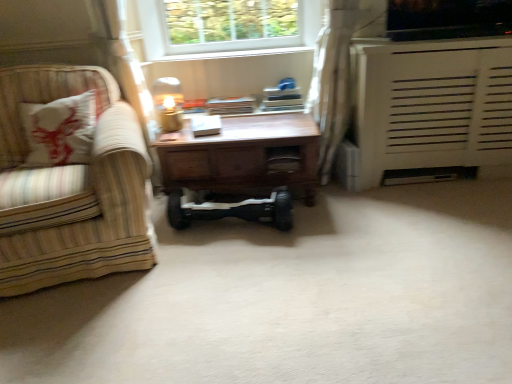
At what (x,y) coordinates should I click in order to perform the action: click on wooden desk at center. Please return your answer as a coordinate pair (x, y). This screenshot has width=512, height=384. Looking at the image, I should click on (239, 170).

Identify the location of white sheer curtain at upper right. The width and height of the screenshot is (512, 384). (332, 81).

Describe the element at coordinates (230, 208) in the screenshot. I see `black rubber hoverboard at center` at that location.

Describe the element at coordinates (168, 103) in the screenshot. I see `matte gold table lamp at center` at that location.

Image resolution: width=512 pixels, height=384 pixels. What do you see at coordinates (432, 105) in the screenshot? I see `white matte radiator at right` at bounding box center [432, 105].

The height and width of the screenshot is (384, 512). What are the coordinates of `striped fabric armchair at left` in the screenshot? It's located at (72, 188).

Locate an element on the screen. Image resolution: width=512 pixels, height=384 pixels. wooden desk at center is located at coordinates (239, 170).

Based on the photo, is wooden drawer at center bigger than matte gold table lamp at center?

No.

Between point (291, 159) and point (164, 86), which one is positioned behind?

The point (164, 86) is more distant.

Is the depth of wooden drawer at center greater than that of matte gold table lamp at center?

Yes.

Is wooden drawer at center directly adjacent to matte gold table lamp at center?

wooden drawer at center is not next to matte gold table lamp at center, and they're not touching.

Which of these two, wooden drawer at center or black rubber hoverboard at center, is smaller?

wooden drawer at center is smaller.

Could you tell me if wooden drawer at center is turned towards black rubber hoverboard at center?

No, wooden drawer at center is not oriented towards black rubber hoverboard at center.

From the image's perspective, between wooden drawer at center and black rubber hoverboard at center, who is located below?

From the image's view, black rubber hoverboard at center is below.

Would you say wooden drawer at center is a long distance from black rubber hoverboard at center?

That's not correct — wooden drawer at center is a little close to black rubber hoverboard at center.

Locate an element on the screen. curtain on the right of striped fabric armchair at left is located at coordinates (332, 81).

In the image, is striped fabric armchair at left positioned in front of or behind white sheer curtain at upper right?

Visually, striped fabric armchair at left is located in front of white sheer curtain at upper right.

Can you confirm if striped fabric armchair at left is positioned to the right of white sheer curtain at upper right?

No, striped fabric armchair at left is not to the right of white sheer curtain at upper right.

From the image's perspective, is striped fabric armchair at left below white sheer curtain at upper right?

Yes.

From the image's perspective, would you say matte gold table lamp at center is positioned over wooden desk at center?

Indeed, from the image's perspective, matte gold table lamp at center is shown above wooden desk at center.

Is the depth of matte gold table lamp at center greater than that of wooden desk at center?

Yes, it is behind wooden desk at center.

Are matte gold table lamp at center and wooden desk at center located far from each other?

Actually, matte gold table lamp at center and wooden desk at center are a little close together.

Does matte gold table lamp at center have a lesser width compared to wooden desk at center?

Yes, matte gold table lamp at center is thinner than wooden desk at center.

Does black rubber hoverboard at center have a larger size compared to striped fabric armchair at left?

No.

How different are the orientations of black rubber hoverboard at center and striped fabric armchair at left in degrees?

23.6 degrees.

Considering the relative sizes of black rubber hoverboard at center and striped fabric armchair at left in the image provided, is black rubber hoverboard at center taller than striped fabric armchair at left?

No.

You are a GUI agent. You are given a task and a screenshot of the screen. Output one action in this format:
    pyautogui.click(x=<x>, y=<y>)
    Task: Click on the chair that appears in front of the black rubber hoverboard at center
    The height and width of the screenshot is (384, 512).
    Given the screenshot: What is the action you would take?
    (72, 188)

In the image, is striped fabric armchair at left positioned in front of or behind black rubber hoverboard at center?

In the image, striped fabric armchair at left appears in front of black rubber hoverboard at center.

Who is bigger, striped fabric armchair at left or black rubber hoverboard at center?

striped fabric armchair at left.

Choose the correct answer: Is striped fabric armchair at left inside black rubber hoverboard at center or outside it?

striped fabric armchair at left is located beyond the bounds of black rubber hoverboard at center.

Is striped fabric armchair at left placed right next to black rubber hoverboard at center?

No, striped fabric armchair at left is not making contact with black rubber hoverboard at center.

From a real-world perspective, is black rubber hoverboard at center on wooden drawer at center?

Actually, black rubber hoverboard at center is physically below wooden drawer at center in the real world.

Is black rubber hoverboard at center not near wooden drawer at center?

No, there isn't a large distance between black rubber hoverboard at center and wooden drawer at center.

Who is taller, black rubber hoverboard at center or wooden drawer at center?

black rubber hoverboard at center.

Does black rubber hoverboard at center turn towards wooden drawer at center?

No, black rubber hoverboard at center is not aimed at wooden drawer at center.

Where is `table lamp above the wooden drawer at center (from a real-world perspective)`? The height and width of the screenshot is (384, 512). table lamp above the wooden drawer at center (from a real-world perspective) is located at coordinates (168, 103).

Image resolution: width=512 pixels, height=384 pixels. I want to click on baby carriage lying below the wooden drawer at center (from the image's perspective), so click(230, 208).

Based on their spatial positions, is white matte radiator at right or wooden drawer at center further from white sheer curtain at upper right?

The object further to white sheer curtain at upper right is wooden drawer at center.

Which object lies nearer to the anchor point wooden drawer at center, matte gold table lamp at center or black rubber hoverboard at center?

Based on the image, black rubber hoverboard at center appears to be nearer to wooden drawer at center.

Which object lies further to the anchor point matte gold table lamp at center, wooden drawer at center or striped fabric armchair at left?

wooden drawer at center is positioned further to the anchor matte gold table lamp at center.

Which object lies nearer to the anchor point black rubber hoverboard at center, wooden desk at center or matte gold table lamp at center?

wooden desk at center.

Consider the image. Considering their positions, is matte gold table lamp at center positioned closer to black rubber hoverboard at center than white matte radiator at right?

Among the two, matte gold table lamp at center is located nearer to black rubber hoverboard at center.

From the image, which object appears to be nearer to white matte radiator at right, white sheer curtain at upper right or matte gold table lamp at center?

The object closer to white matte radiator at right is white sheer curtain at upper right.

Considering their positions, is wooden drawer at center positioned further to white matte radiator at right than wooden desk at center?

wooden drawer at center lies further to white matte radiator at right than the other object.

Based on their spatial positions, is striped fabric armchair at left or wooden desk at center closer to black rubber hoverboard at center?

Based on the image, wooden desk at center appears to be nearer to black rubber hoverboard at center.

At what (x,y) coordinates should I click in order to perform the action: click on baby carriage located between matte gold table lamp at center and white matte radiator at right in the left-right direction. Please return your answer as a coordinate pair (x, y). Looking at the image, I should click on (230, 208).

Where is `baby carriage located between striped fabric armchair at left and white matte radiator at right in the left-right direction`? Image resolution: width=512 pixels, height=384 pixels. baby carriage located between striped fabric armchair at left and white matte radiator at right in the left-right direction is located at coordinates (230, 208).

You are a GUI agent. You are given a task and a screenshot of the screen. Output one action in this format:
    pyautogui.click(x=<x>, y=<y>)
    Task: Click on the baby carriage located between striped fabric armchair at left and wooden desk at center in the left-right direction
    The width and height of the screenshot is (512, 384).
    Given the screenshot: What is the action you would take?
    pyautogui.click(x=230, y=208)

Find the location of a particular element. Image resolution: width=512 pixels, height=384 pixels. table between striped fabric armchair at left and matte gold table lamp at center along the z-axis is located at coordinates (239, 170).